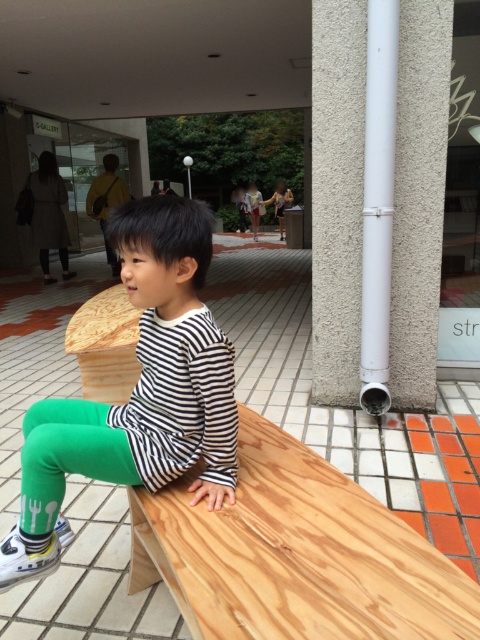
Question: Considering the relative positions of green cotton pants at center and green matte leggings at lower left in the image provided, where is green cotton pants at center located with respect to green matte leggings at lower left?

Choices:
 (A) below
 (B) above

Answer: (B)

Question: Which point is closer to the camera?

Choices:
 (A) (219, 468)
 (B) (69, 472)

Answer: (B)

Question: Is green cotton pants at center smaller than green matte leggings at lower left?

Choices:
 (A) no
 (B) yes

Answer: (A)

Question: Which of the following is the closest to the observer?

Choices:
 (A) green cotton pants at center
 (B) green matte leggings at lower left

Answer: (B)

Question: Does green cotton pants at center appear on the left side of green matte leggings at lower left?

Choices:
 (A) yes
 (B) no

Answer: (B)

Question: Which point is farther from the camera taking this photo?

Choices:
 (A) tap(99, 416)
 (B) tap(183, 273)

Answer: (A)